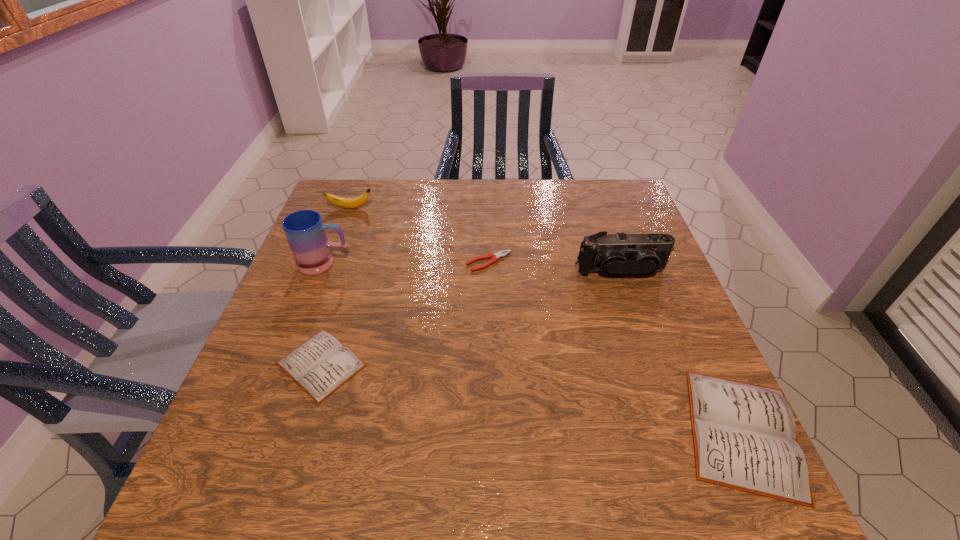
The width and height of the screenshot is (960, 540). Find the location of `vacant area located 0.150m on the right of the second shortest object`. vacant area located 0.150m on the right of the second shortest object is located at coordinates (440, 364).

At what (x,y) coordinates should I click in order to perform the action: click on free spot located 0.320m on the left of the fourth tallest object. Please return your answer as a coordinate pair (x, y). Looking at the image, I should click on (505, 432).

The width and height of the screenshot is (960, 540). In order to click on free location located on the side of the mug with the handle in this screenshot , I will do `click(390, 264)`.

At what (x,y) coordinates should I click in order to perform the action: click on free region located 0.340m on the back of the pliers. Please return your answer as a coordinate pair (x, y). This screenshot has height=540, width=960. Looking at the image, I should click on (487, 185).

Identify the location of free space located at the stem of the banana. (396, 208).

The image size is (960, 540). In order to click on free spot located on the front-facing side of the second tallest object in this screenshot , I will do `click(660, 381)`.

You are a GUI agent. You are given a task and a screenshot of the screen. Output one action in this format:
    pyautogui.click(x=<x>, y=<y>)
    Task: Click on the object present at the far edge
    
    Given the screenshot: What is the action you would take?
    pyautogui.click(x=349, y=203)

Identify the location of diary located in the left edge section of the desktop. The height and width of the screenshot is (540, 960). (320, 365).

Image resolution: width=960 pixels, height=540 pixels. Find the location of `mug present at the left edge`. mug present at the left edge is located at coordinates (305, 231).

At what (x,y) coordinates should I click in order to perform the action: click on banana located in the left edge section of the desktop. Please return your answer as a coordinate pair (x, y). Looking at the image, I should click on (349, 203).